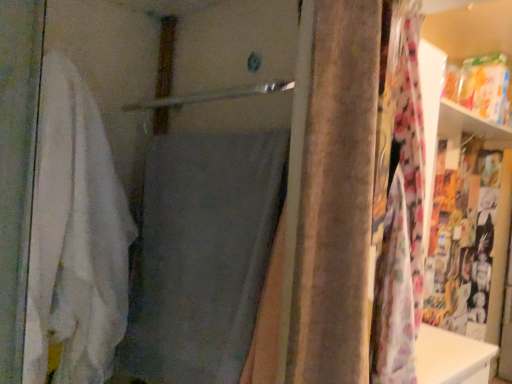
Question: Looking at their shapes, would you say velvet brown curtain at center is wider or thinner than white soft towel at left, acting as the first bath towel starting from the left?

Choices:
 (A) wide
 (B) thin

Answer: (B)

Question: Is point (380, 309) closer or farther from the camera than point (106, 273)?

Choices:
 (A) closer
 (B) farther

Answer: (A)

Question: Which object is positioned farthest from the velvet brown curtain at center?

Choices:
 (A) gray fabric bath towel at center, the 2th bath towel positioned from the left
 (B) white soft towel at left, acting as the first bath towel starting from the left

Answer: (B)

Question: Considering the real-world distances, which object is farthest from the white soft towel at left, which appears as the 2th bath towel when viewed from the right?

Choices:
 (A) gray fabric bath towel at center, arranged as the first bath towel when viewed from the right
 (B) velvet brown curtain at center

Answer: (B)